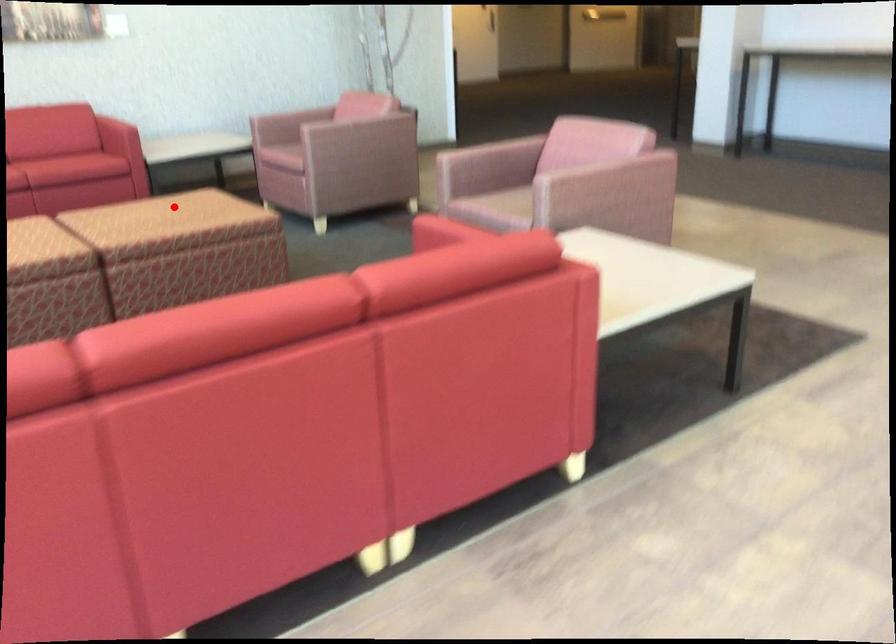
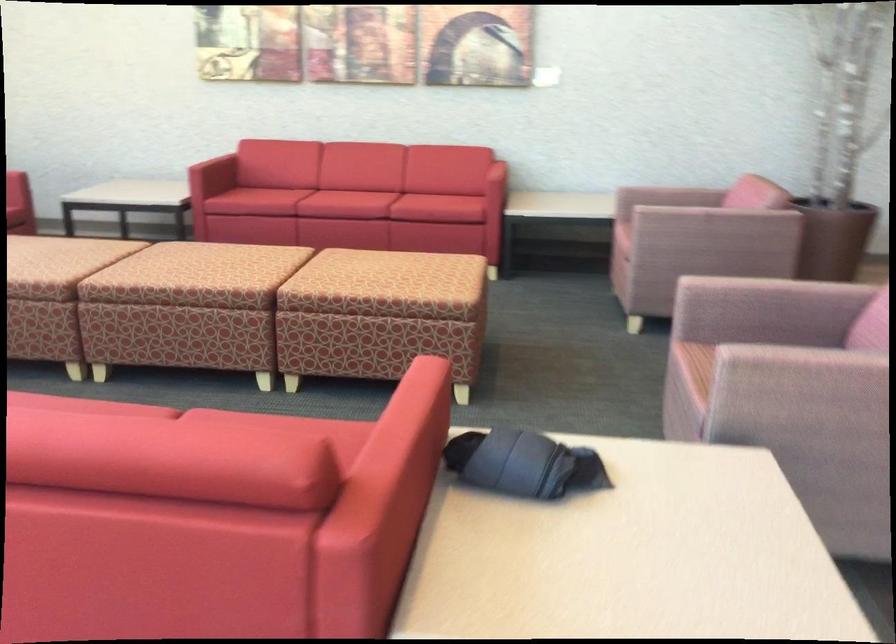
Question: I am providing you with two images of the same scene from different viewpoints. In image1, a red point is highlighted. Considering the same 3D point in image2, which of the following is correct?

Choices:
 (A) It is closer
 (B) It is farther

Answer: (A)